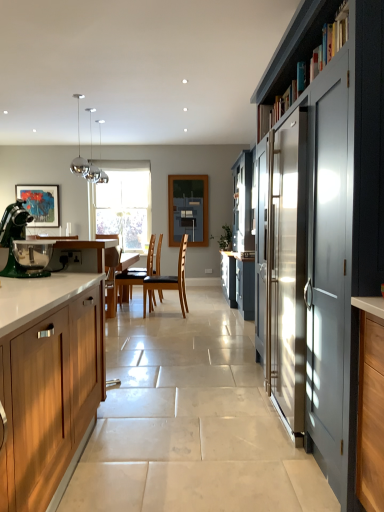
Question: Is brown leather chair at center, acting as the first chair starting from the front, bigger or smaller than green matte stand mixer at left?

Choices:
 (A) big
 (B) small

Answer: (A)

Question: In terms of height, does brown leather chair at center, which is counted as the 2th chair, starting from the left, look taller or shorter compared to green matte stand mixer at left?

Choices:
 (A) tall
 (B) short

Answer: (A)

Question: Estimate the real-world distances between objects in this image. Which object is closer to the brown leather chair at center, positioned as the second chair in front-to-back order?

Choices:
 (A) dark gray wooden shelf at upper right
 (B) clear glass window at center
 (C) brown leather chair at center, the second chair in the back-to-front sequence
 (D) satin grey cabinet at right, the 2th cabinetry positioned from the left
 (E) green matte stand mixer at left

Answer: (B)

Question: Considering the real-world distances, which object is farthest from the clear glass window at center?

Choices:
 (A) satin grey cabinet at right, the 2th cabinetry positioned from the left
 (B) matte acrylic painting at left
 (C) wooden cabinet at left, which is counted as the 2th cabinetry, starting from the right
 (D) blue painted wood window screen at center
 (E) brown leather chair at center, the second chair when ordered from right to left

Answer: (C)